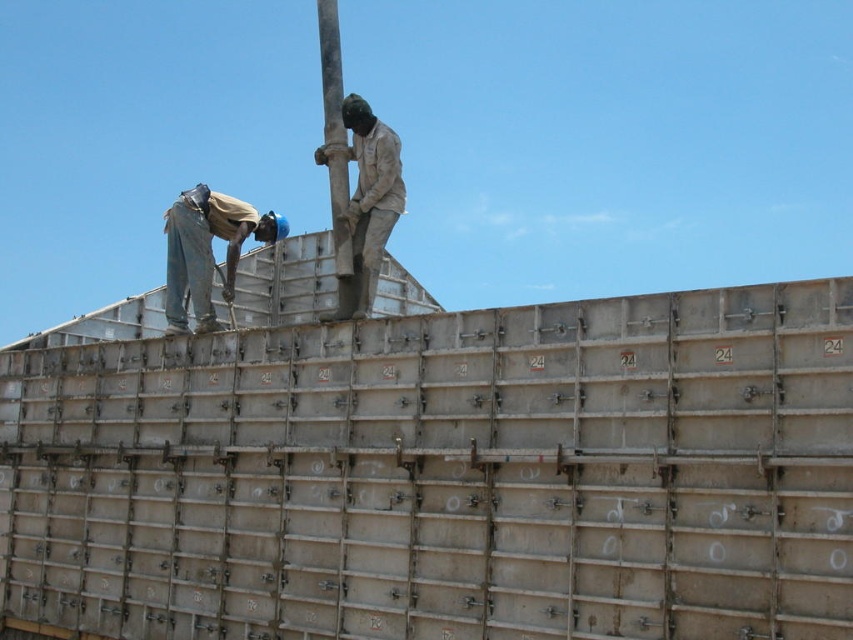
Question: Which object is farther from the camera taking this photo?

Choices:
 (A) smooth metallic pole at upper center
 (B) gray metallic panels at upper center
 (C) brown denim jeans at upper left
 (D) dirty beige uniform at center

Answer: (C)

Question: Does gray metallic panels at upper center have a greater width compared to smooth metallic pole at upper center?

Choices:
 (A) yes
 (B) no

Answer: (A)

Question: Can you confirm if dirty beige uniform at center is positioned to the left of smooth metallic pole at upper center?

Choices:
 (A) yes
 (B) no

Answer: (B)

Question: Which of the following is the closest to the observer?

Choices:
 (A) (376, 230)
 (B) (334, 250)
 (C) (194, 273)
 (D) (39, 484)

Answer: (A)

Question: In this image, where is dirty beige uniform at center located relative to smooth metallic pole at upper center?

Choices:
 (A) left
 (B) right

Answer: (B)

Question: Among these objects, which one is farthest from the camera?

Choices:
 (A) brown denim jeans at upper left
 (B) gray metallic panels at upper center
 (C) dirty beige uniform at center

Answer: (A)